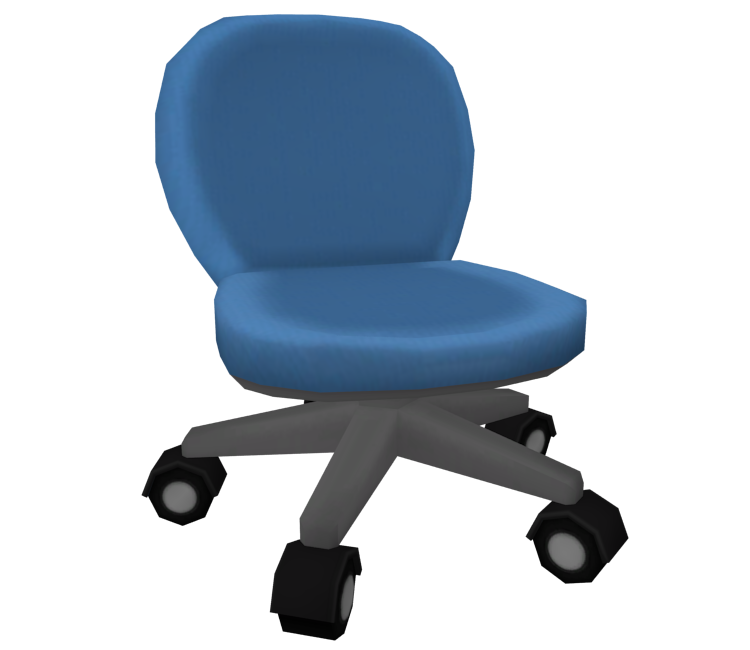
Locate an element on the screen. blue seat is located at coordinates (375, 356).